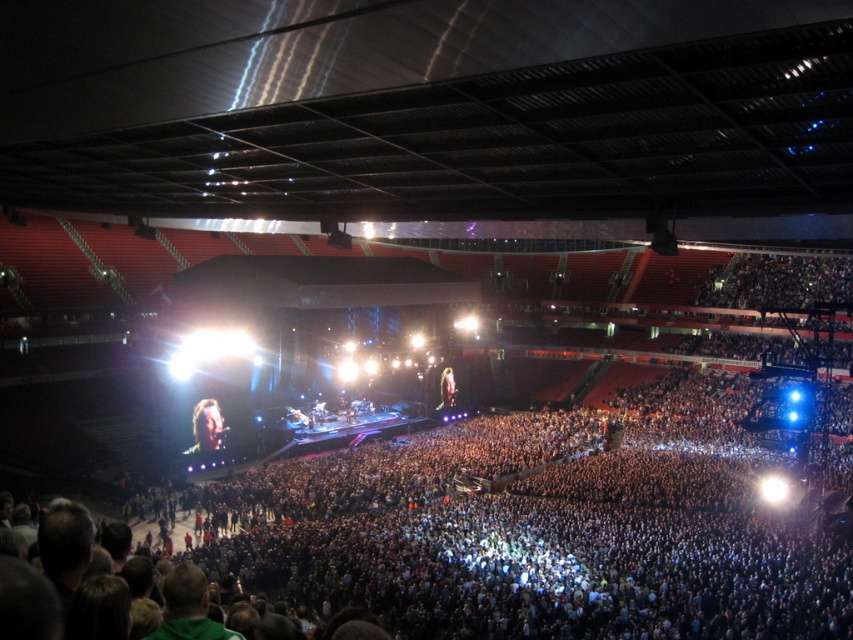
You are a photographer at the concert and want to capture both the shiny brown hair at center and the shiny gold hair at center in a single frame. Based on their sizes, which one should you zoom in on to ensure both fit in the photo?

Since the shiny brown hair at center is wider than the shiny gold hair at center, you should zoom out to capture both in the frame.